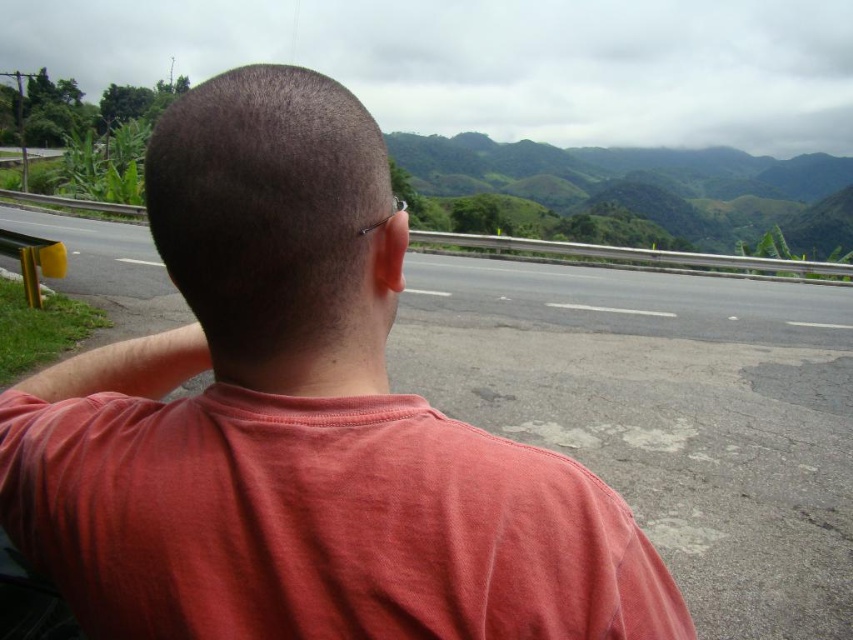
From the picture: Does pink cotton shirt at center have a smaller size compared to cotton t-shirt at center?

No, pink cotton shirt at center is not smaller than cotton t-shirt at center.

Which is behind, point (326, 198) or point (175, 456)?

Positioned behind is point (175, 456).

You are a GUI agent. You are given a task and a screenshot of the screen. Output one action in this format:
    pyautogui.click(x=<x>, y=<y>)
    Task: Click on the pink cotton shirt at center
    
    Given the screenshot: What is the action you would take?
    pyautogui.click(x=299, y=424)

What do you see at coordinates (318, 524) in the screenshot? I see `cotton t-shirt at center` at bounding box center [318, 524].

At what (x,y) coordinates should I click in order to perform the action: click on cotton t-shirt at center. Please return your answer as a coordinate pair (x, y). Looking at the image, I should click on (318, 524).

Is cotton t-shirt at center shorter than green grassy hill at upper center?

Yes.

Is point (419, 458) positioned before point (635, 189)?

Yes, it is.

Between point (648, 563) and point (523, 188), which one is positioned in front?

Point (648, 563) is more forward.

This screenshot has height=640, width=853. Find the location of `cotton t-shirt at center`. cotton t-shirt at center is located at coordinates (318, 524).